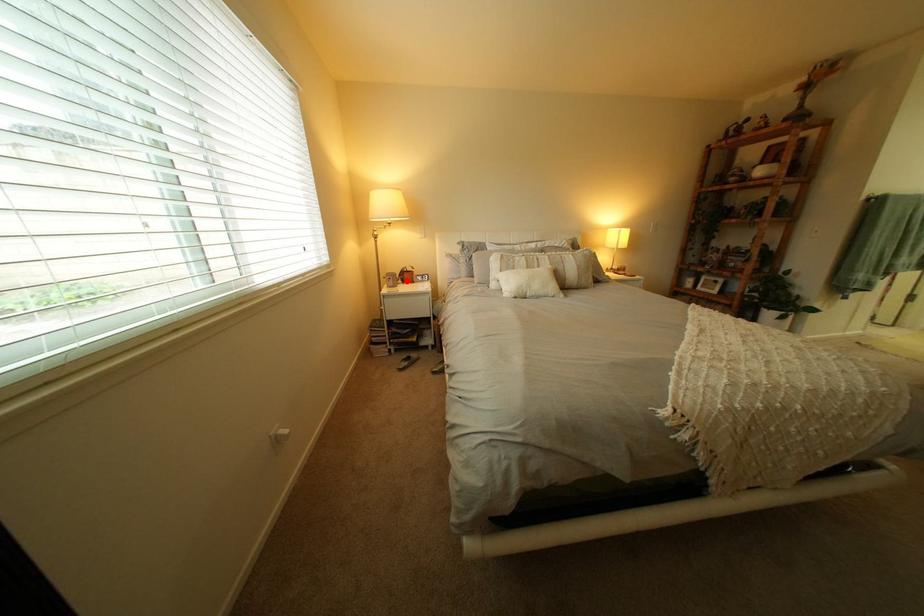
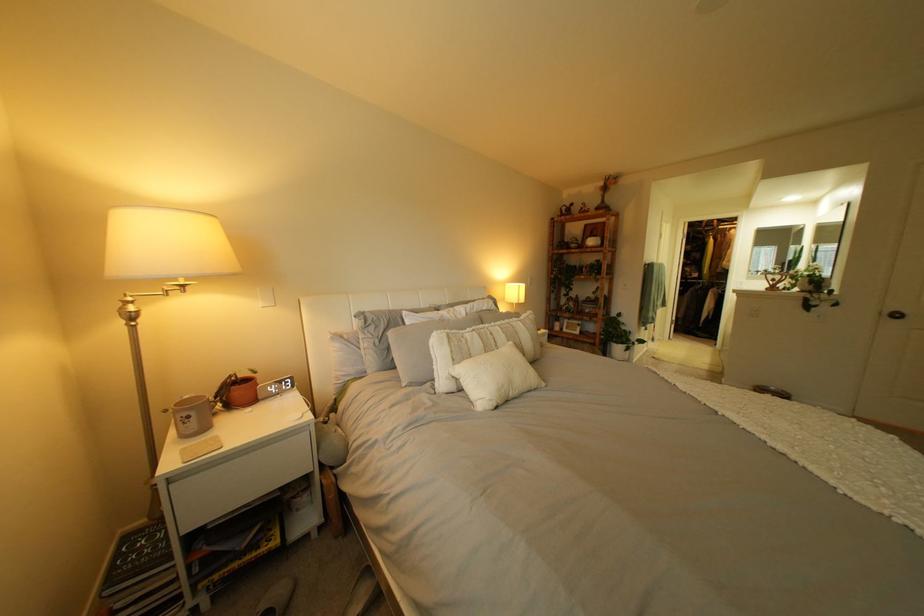
Locate, in the second image, the point that corresponds to the highlighted location in the first image.

(209, 419)